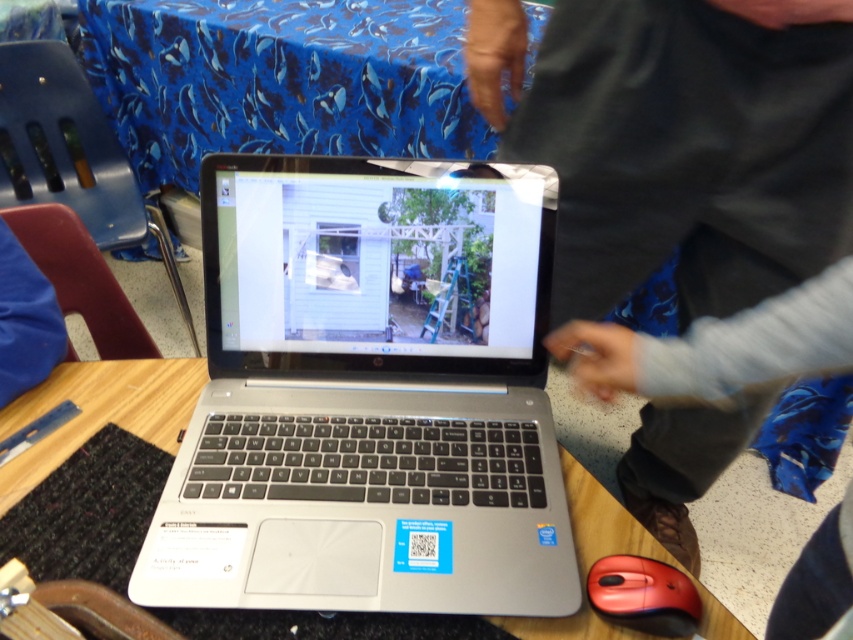
You are sitting at a desk and want to reach the gray fabric at upper center which is behind the silver metallic laptop at center. Can you move the laptop to access it?

The silver metallic laptop at center is further to the viewer than gray fabric at upper center, so yes, you can move the silver metallic laptop at center to access the gray fabric at upper center since it is closer to you.

You are looking at the laptop screen showing the shed with a ladder. There are two points marked on the screen at coordinates point (183, 401) and point (648, 625). If you were to reach out and touch the screen, which point would feel closer to you?

Point (183, 401) is further to the camera than point (648, 625), so when touching the screen, both points are actually at the same physical distance since they are on the screen. However, based on their positions in the image, point (183, 401) appears closer in the scene depicted, but physically on the screen, they are equally distant.

You are a delivery robot with a package that is 36 inches long. You need to place the package between the silver metallic laptop at center and the blue fabric tablecloth at upper center on the table. Can the package fit in that space?

The silver metallic laptop at center and blue fabric tablecloth at upper center are 37.13 inches apart from each other. Since the package is 36 inches long, it can fit in the space between them as there is enough room.